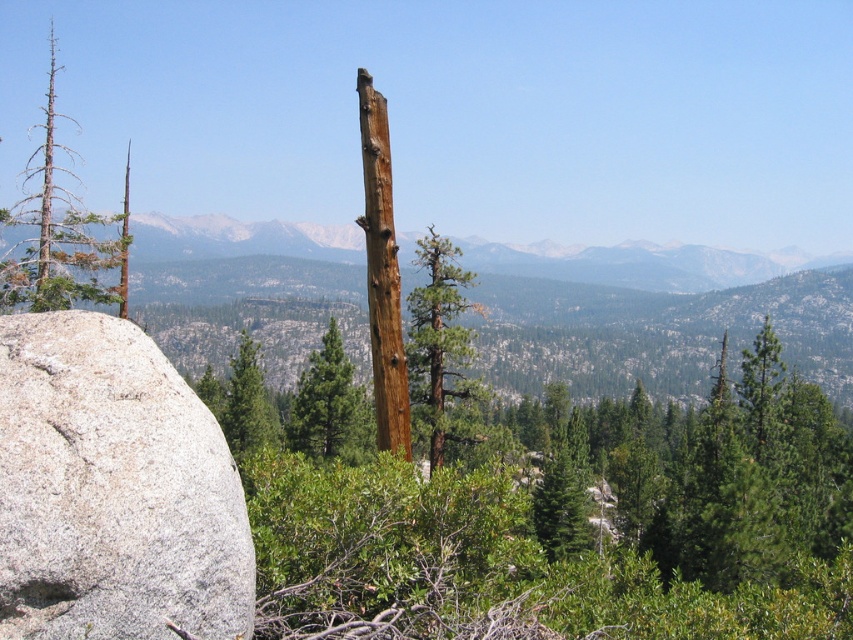
Can you confirm if brown rough wood at center is positioned to the right of green rough bark tree at center?

Yes, brown rough wood at center is to the right of green rough bark tree at center.

Measure the distance between brown rough wood at center and green rough bark tree at center.

brown rough wood at center and green rough bark tree at center are 7.05 meters apart.

Which is behind, point (373, 316) or point (344, 460)?

Positioned behind is point (344, 460).

In order to click on brown rough wood at center in this screenshot , I will do `click(381, 273)`.

Between point (386, 214) and point (432, 381), which one is positioned behind?

Positioned behind is point (432, 381).

Is brown rough wood at center taller than green matte tree at center?

Yes.

Is point (360, 115) less distant than point (421, 346)?

Yes, it is.

I want to click on brown rough wood at center, so click(381, 273).

Which is more to the left, rocky mountain range at center or brown rough wood at center?

From the viewer's perspective, brown rough wood at center appears more on the left side.

Can you confirm if rocky mountain range at center is thinner than brown rough wood at center?

Incorrect, rocky mountain range at center's width is not less than brown rough wood at center's.

The image size is (853, 640). What do you see at coordinates (643, 264) in the screenshot? I see `rocky mountain range at center` at bounding box center [643, 264].

This screenshot has width=853, height=640. Find the location of `rocky mountain range at center`. rocky mountain range at center is located at coordinates (643, 264).